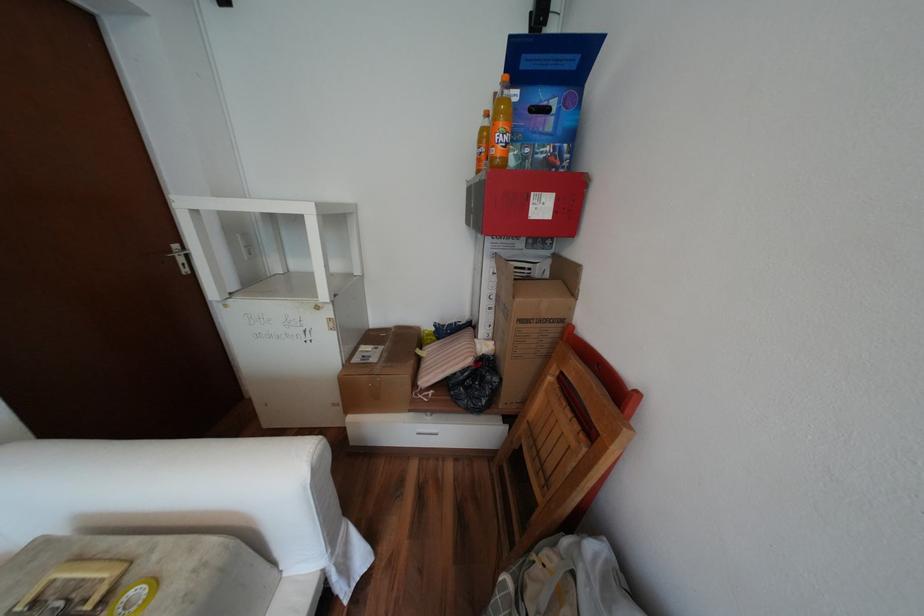
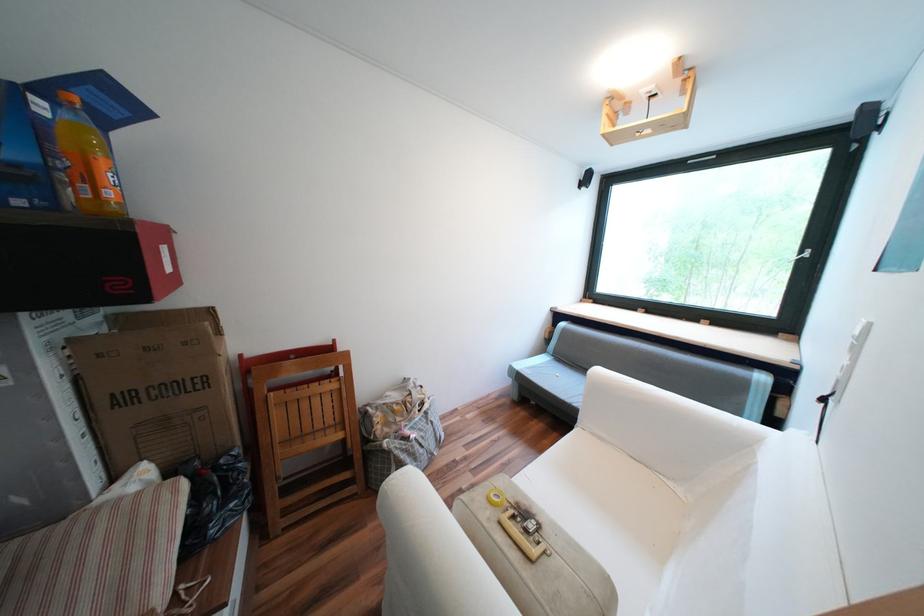
Locate, in the second image, the point that corresponds to pixel 430 572 in the first image.

(387, 548)